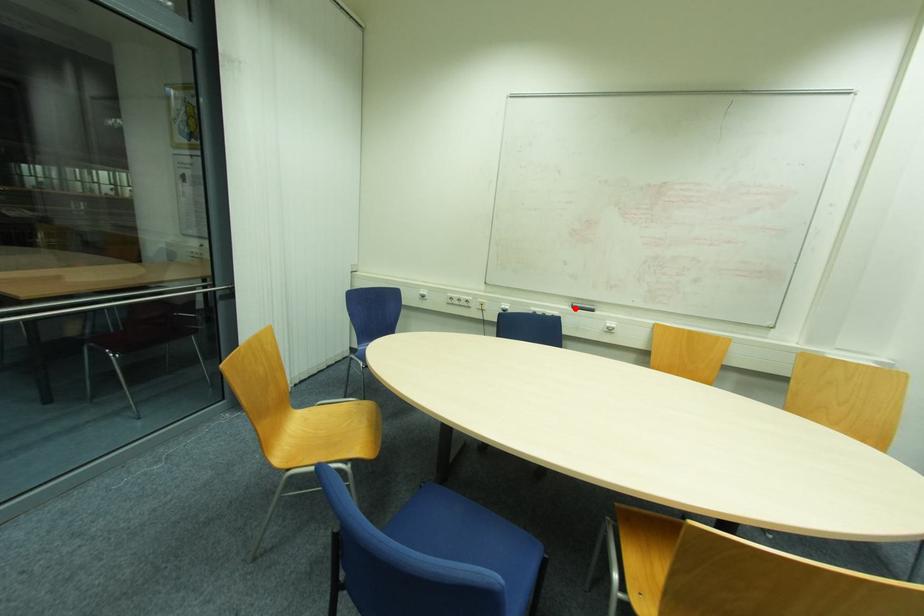
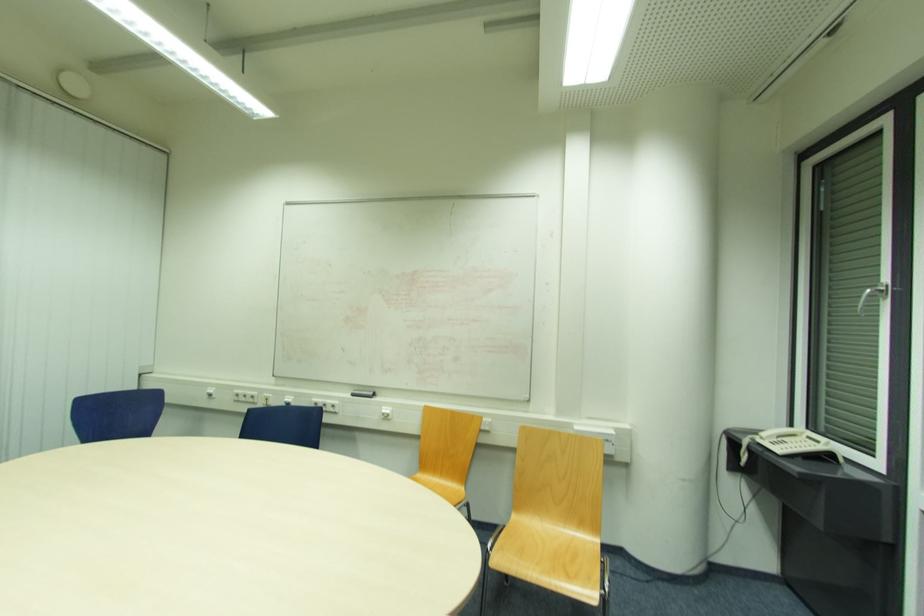
The point at the highlighted location is marked in the first image. Where is the corresponding point in the second image?

(355, 395)